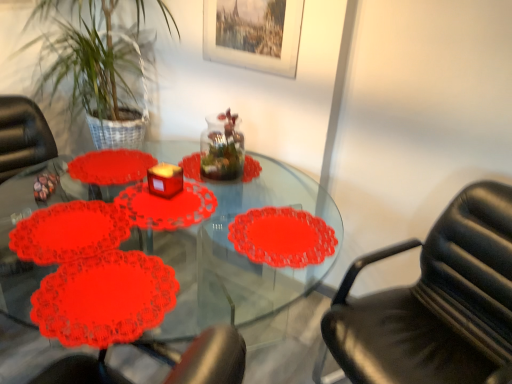
Locate an element on the screen. vacant space positioned to the left of matte red candle at center is located at coordinates (131, 187).